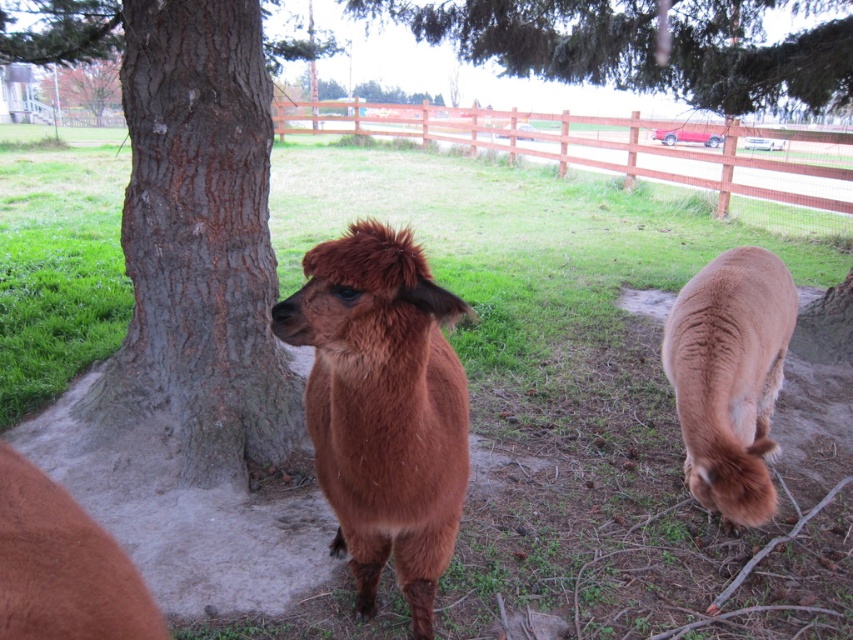
Who is higher up, brown fluffy alpaca at center or green leafy tree at upper center?

green leafy tree at upper center is above.

The width and height of the screenshot is (853, 640). What are the coordinates of `brown fluffy alpaca at center` in the screenshot? It's located at (383, 406).

What are the coordinates of `brown fluffy alpaca at center` in the screenshot? It's located at (383, 406).

Is brown fluffy alpaca at center taller than brown wooden fence at upper center?

No, brown fluffy alpaca at center is not taller than brown wooden fence at upper center.

Measure the distance between point (403, 512) and camera.

A distance of 6.04 feet exists between point (403, 512) and camera.

Image resolution: width=853 pixels, height=640 pixels. In order to click on brown fluffy alpaca at center in this screenshot , I will do `click(383, 406)`.

Which is more to the right, brown woolen camel at lower right or brown wooden fence at upper center?

brown wooden fence at upper center

Is brown woolen camel at lower right thinner than brown wooden fence at upper center?

Yes, brown woolen camel at lower right is thinner than brown wooden fence at upper center.

Between point (705, 460) and point (589, 138), which one is positioned behind?

Positioned behind is point (589, 138).

At what (x,y) coordinates should I click in order to perform the action: click on brown woolen camel at lower right. Please return your answer as a coordinate pair (x, y). The width and height of the screenshot is (853, 640). Looking at the image, I should click on click(x=730, y=378).